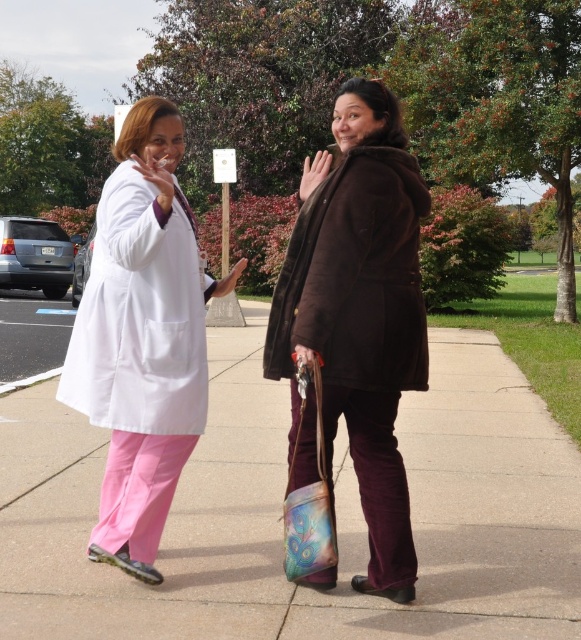
Is point (299, 609) positioned after point (141, 163)?

No, (299, 609) is in front of (141, 163).

Does pink fabric pants at lower left appear on the left side of white matte lab coat at left?

Correct, you'll find pink fabric pants at lower left to the left of white matte lab coat at left.

Does point (460, 458) come behind point (101, 289)?

Yes, it is.

Locate an element on the screen. pink fabric pants at lower left is located at coordinates (281, 508).

Which is behind, point (277, 432) or point (419, 189)?

Point (277, 432)

Is pink fabric pants at lower left thinner than brown suede coat at center?

Indeed, pink fabric pants at lower left has a lesser width compared to brown suede coat at center.

Does point (252, 568) lie behind point (279, 310)?

Yes, it is.

I want to click on pink fabric pants at lower left, so click(x=281, y=508).

Which is more to the right, white matte lab coat at left or brown suede coat at center?

Positioned to the right is brown suede coat at center.

Measure the distance from white matte lab coat at left to brown suede coat at center.

white matte lab coat at left is 25.38 inches from brown suede coat at center.

The image size is (581, 640). Identify the location of white matte lab coat at left. (141, 339).

Locate an element on the screen. This screenshot has height=640, width=581. white matte lab coat at left is located at coordinates (141, 339).